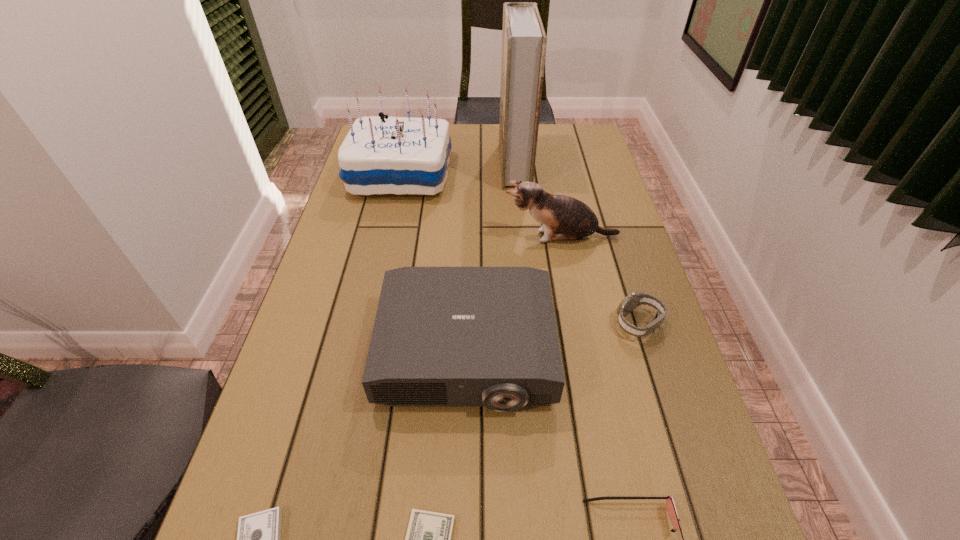
In order to click on vacant space located 0.220m at the face of the sixth nearest object in this screenshot , I will do `click(424, 237)`.

Locate an element on the screen. The width and height of the screenshot is (960, 540). vacant position located at the face of the sixth nearest object is located at coordinates [x=417, y=237].

Where is `vacant space located at the face of the sixth nearest object`? This screenshot has height=540, width=960. vacant space located at the face of the sixth nearest object is located at coordinates (363, 237).

In order to click on free region located on the front-facing side of the fourth tallest object in this screenshot , I will do `click(463, 480)`.

Locate an element on the screen. This screenshot has width=960, height=540. vacant space located on the face of the watch is located at coordinates (550, 323).

Locate an element on the screen. free space located on the face of the watch is located at coordinates (493, 323).

Identify the location of free space located on the face of the watch. The width and height of the screenshot is (960, 540). (564, 323).

Locate an element on the screen. phonebook at the far edge is located at coordinates (524, 41).

The image size is (960, 540). What are the coordinates of `birthday cake that is at the far edge` in the screenshot? It's located at (396, 155).

This screenshot has height=540, width=960. In order to click on object that is positioned at the left edge in this screenshot , I will do `click(396, 155)`.